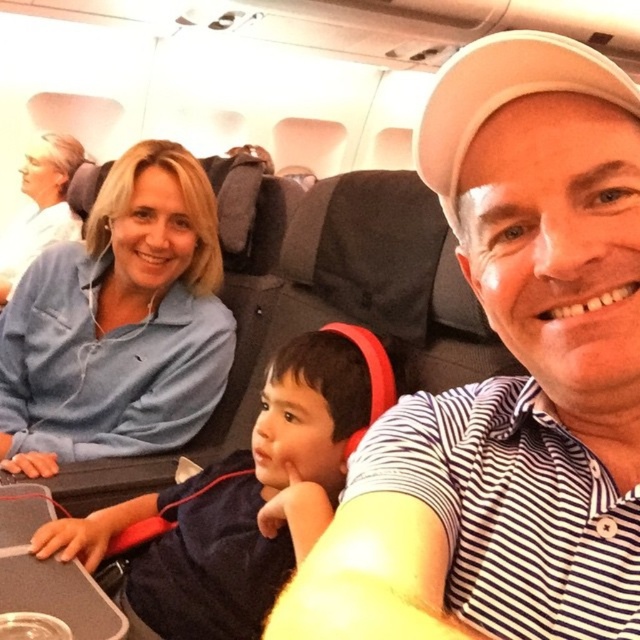
Is white striped polo shirt at center shorter than blue cotton shirt at upper left?

Yes.

Which is more to the right, white striped polo shirt at center or blue cotton shirt at upper left?

From the viewer's perspective, white striped polo shirt at center appears more on the right side.

The image size is (640, 640). I want to click on white striped polo shirt at center, so click(x=508, y=378).

Does blue cotton shirt at upper left have a greater height compared to dark blue fabric at center?

Yes, blue cotton shirt at upper left is taller than dark blue fabric at center.

Between point (65, 332) and point (138, 586), which one is positioned behind?

The point (65, 332) is more distant.

Which is in front, point (204, 312) or point (307, 516)?

Positioned in front is point (307, 516).

At what (x,y) coordinates should I click in order to perform the action: click on blue cotton shirt at upper left. Please return your answer as a coordinate pair (x, y). The image size is (640, 640). Looking at the image, I should click on (120, 323).

Which of these two, white striped polo shirt at center or dark blue fabric at center, stands shorter?

With less height is white striped polo shirt at center.

Does point (528, 548) come behind point (328, 502)?

No.

Where is `white striped polo shirt at center`? This screenshot has width=640, height=640. white striped polo shirt at center is located at coordinates (508, 378).

The height and width of the screenshot is (640, 640). I want to click on white striped polo shirt at center, so click(x=508, y=378).